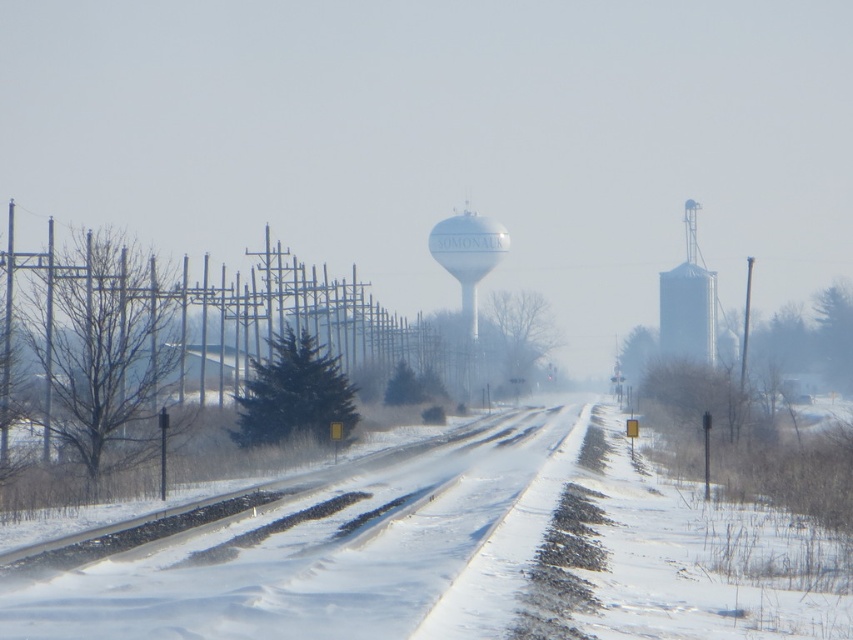
Can you confirm if white matte silo at right is thinner than white matte water tower at center?

No, white matte silo at right is not thinner than white matte water tower at center.

This screenshot has height=640, width=853. I want to click on white matte silo at right, so click(x=688, y=300).

Find the location of `white matte silo at right`. white matte silo at right is located at coordinates (688, 300).

Does point (399, 618) come closer to viewer compared to point (439, 259)?

Yes.

Is point (309, 564) more distant than point (430, 250)?

No, it is in front of (430, 250).

Where is `snowy asphalt road at center`? The height and width of the screenshot is (640, 853). snowy asphalt road at center is located at coordinates (308, 554).

Which is in front, point (221, 609) or point (704, 340)?

Point (221, 609)

Does snowy asphalt road at center have a lesser height compared to white matte silo at right?

Yes.

I want to click on snowy asphalt road at center, so click(x=308, y=554).

Identify the location of snowy asphalt road at center. (308, 554).